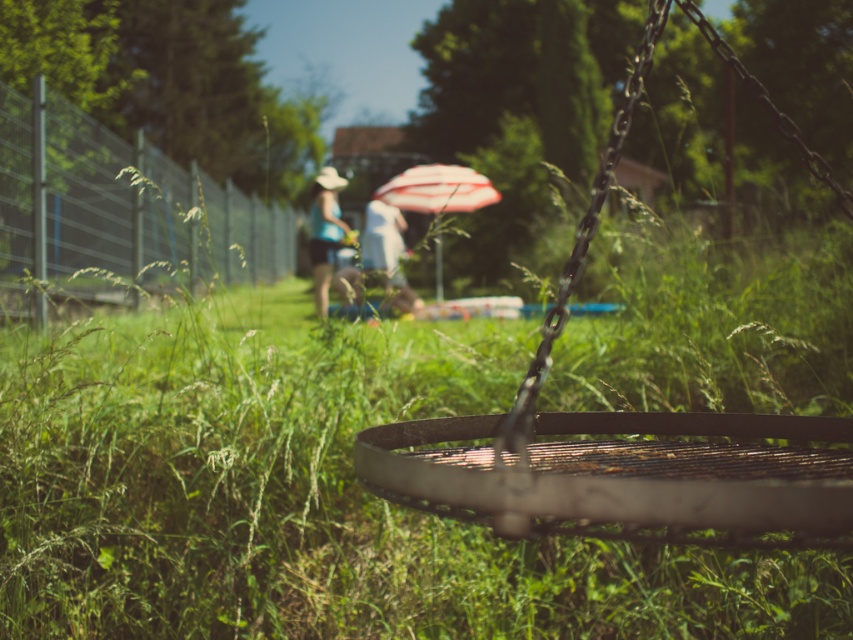
Question: Is rusty metal swing at center bigger than matte blue shirt at center?

Choices:
 (A) yes
 (B) no

Answer: (B)

Question: Among these points, which one is farthest from the camera?

Choices:
 (A) (282, 225)
 (B) (322, 228)
 (C) (434, 273)

Answer: (A)

Question: Which of the following is the farthest from the observer?

Choices:
 (A) metallic wire fence at left
 (B) rusty metal swing at center
 (C) matte blue shirt at center
 (D) striped fabric umbrella at center

Answer: (D)

Question: Is rusty metal swing at center wider than matte blue shirt at center?

Choices:
 (A) no
 (B) yes

Answer: (B)

Question: Estimate the real-world distances between objects in this image. Which object is farther from the rusty metal swing at center?

Choices:
 (A) matte blue shirt at center
 (B) striped fabric umbrella at center
 (C) metallic wire fence at left

Answer: (B)

Question: Can you confirm if metallic wire fence at left is positioned to the right of striped fabric umbrella at center?

Choices:
 (A) yes
 (B) no

Answer: (B)